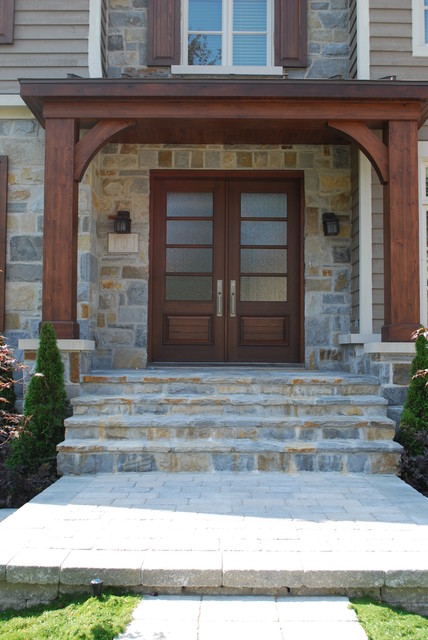
The height and width of the screenshot is (640, 428). I want to click on lights, so click(121, 226), click(330, 225).